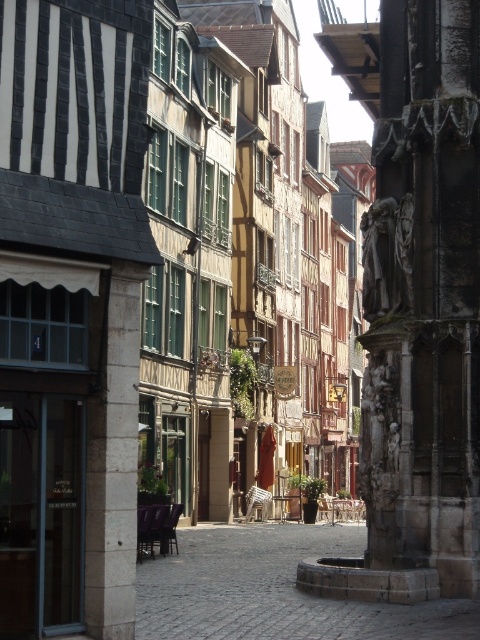
You are a tourist standing in the middle of the brown cobblestone alley at center and want to take a photo of the dark stone sculpture at right. Since you have a camera with a limited zoom, you need to move closer. How should you adjust your position relative to the sculpture to capture it better?

The dark stone sculpture at right is taller than the brown cobblestone alley at center, so moving closer to the sculpture will allow you to capture its full height without the alley blocking the view.